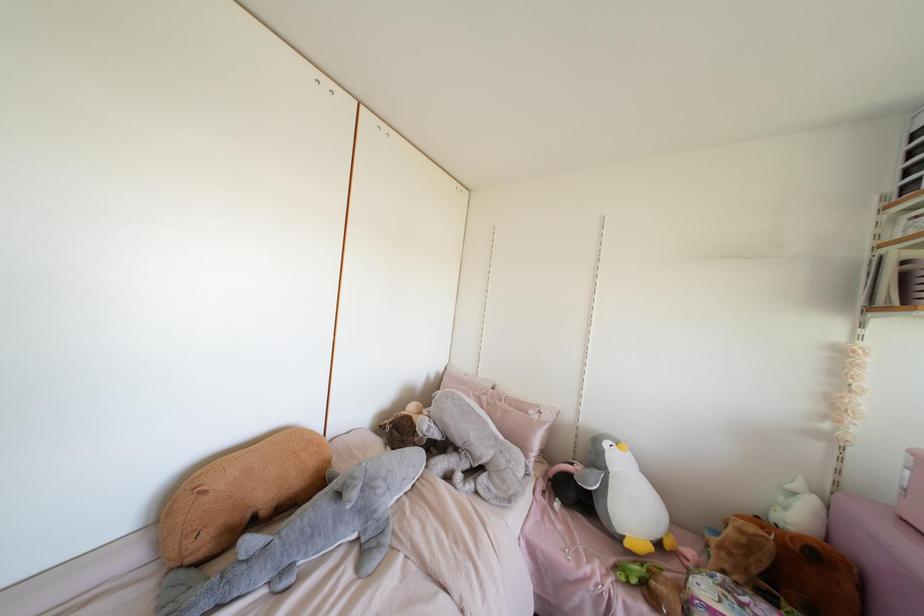
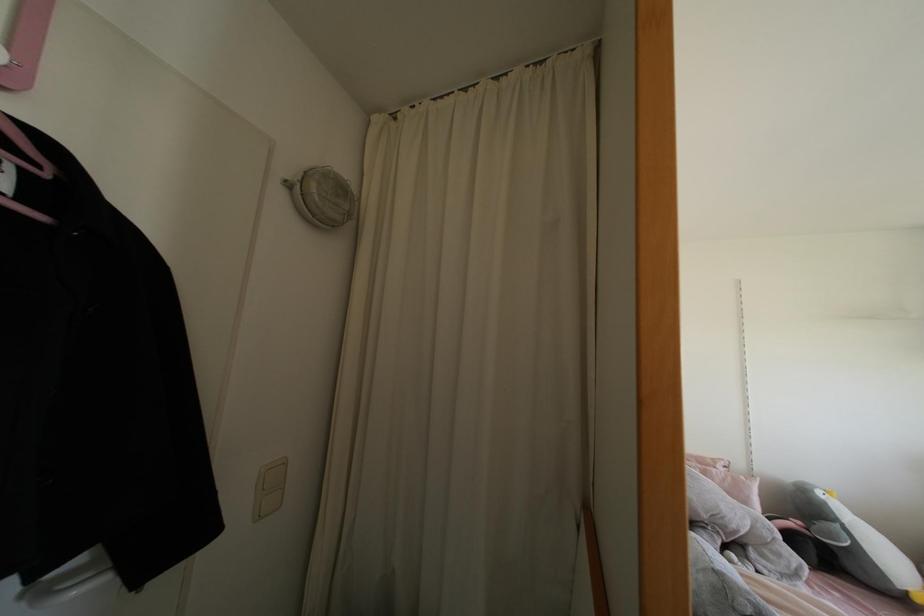
Question: What movement of the cameraman would produce the second image?

Choices:
 (A) Left
 (B) Right
 (C) Forward
 (D) Backward

Answer: (A)